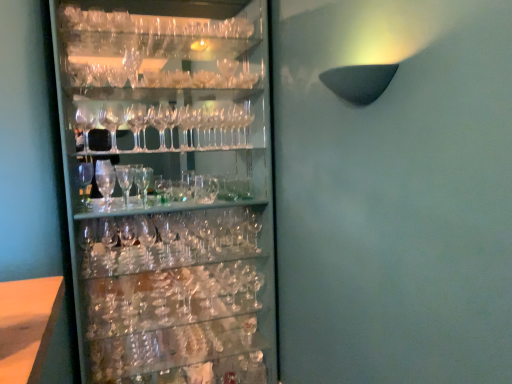
Question: Is clear glass wine glass at upper center in front of or behind clear glass wine glasses at left in the image?

Choices:
 (A) front
 (B) behind

Answer: (B)

Question: From a real-world perspective, is clear glass wine glass at upper center above or below clear glass wine glasses at left?

Choices:
 (A) above
 (B) below

Answer: (A)

Question: Estimate the real-world distances between objects in this image. Which object is farther from the clear glass wine glasses at left?

Choices:
 (A) clear glass wine glass at upper center
 (B) clear glass beer glass at center

Answer: (A)

Question: Which is farther from the clear glass wine glasses at left?

Choices:
 (A) clear glass beer glass at center
 (B) clear glass wine glass at upper center

Answer: (B)